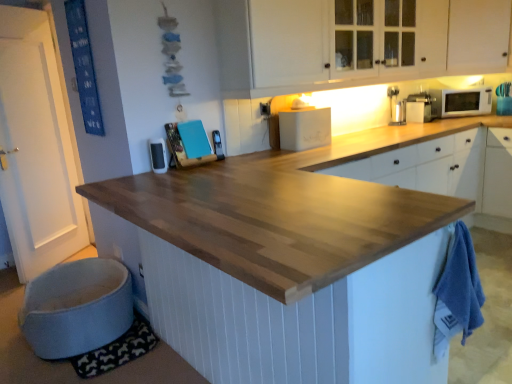
Question: From a real-world perspective, is white glossy microwave at upper right positioned above or below white matte breadbox at upper center, which is the 3th appliance in front-to-back order?

Choices:
 (A) below
 (B) above

Answer: (B)

Question: Is white glossy microwave at upper right in front of or behind white matte breadbox at upper center, which is counted as the second appliance, starting from the back, in the image?

Choices:
 (A) front
 (B) behind

Answer: (B)

Question: Which of these objects is positioned closest to the white glossy microwave at upper center, which is counted as the fourth appliance, starting from the right?

Choices:
 (A) metallic silver phone at center, which is counted as the 3th appliance, starting from the back
 (B) white wood cabinets at upper center, which appears as the first cabinetry when viewed from the left
 (C) white glossy microwave at upper right
 (D) natural wood countertop at center
 (E) white matte cabinet at upper right, which appears as the second cabinetry when viewed from the left

Answer: (A)

Question: Which of these objects is positioned farthest from the white glossy exhaust hood at upper center?

Choices:
 (A) white matte breadbox at upper center, which is the 3th appliance in front-to-back order
 (B) white glossy microwave at upper right
 (C) metallic silver phone at center, the 2th appliance positioned from the front
 (D) natural wood countertop at center
 (E) white wood cabinets at upper center, which appears as the first cabinetry when viewed from the left

Answer: (D)